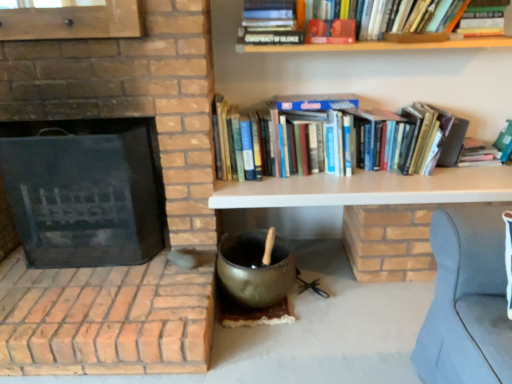
Question: Considering the relative sizes of hardcover books at upper right and white matte shelf at upper center in the image provided, is hardcover books at upper right bigger than white matte shelf at upper center?

Choices:
 (A) yes
 (B) no

Answer: (A)

Question: Is hardcover books at upper right not near white matte shelf at upper center?

Choices:
 (A) no
 (B) yes

Answer: (A)

Question: From the image's perspective, is hardcover books at upper right located above white matte shelf at upper center?

Choices:
 (A) yes
 (B) no

Answer: (A)

Question: Considering the relative positions of hardcover books at upper right and white matte shelf at upper center in the image provided, is hardcover books at upper right behind white matte shelf at upper center?

Choices:
 (A) yes
 (B) no

Answer: (A)

Question: Does hardcover books at upper right have a greater height compared to white matte shelf at upper center?

Choices:
 (A) yes
 (B) no

Answer: (A)

Question: From the image's perspective, is hardcover books at upper right located beneath white matte shelf at upper center?

Choices:
 (A) no
 (B) yes

Answer: (A)

Question: Can you see black matte fireplace at left touching hardcover books at upper right?

Choices:
 (A) yes
 (B) no

Answer: (B)

Question: From the image's perspective, is black matte fireplace at left on hardcover books at upper right?

Choices:
 (A) no
 (B) yes

Answer: (A)

Question: Considering the relative sizes of black matte fireplace at left and hardcover books at upper right in the image provided, is black matte fireplace at left taller than hardcover books at upper right?

Choices:
 (A) yes
 (B) no

Answer: (A)

Question: From a real-world perspective, does black matte fireplace at left sit lower than hardcover books at upper right?

Choices:
 (A) no
 (B) yes

Answer: (B)

Question: Does black matte fireplace at left have a lesser height compared to hardcover books at upper right?

Choices:
 (A) yes
 (B) no

Answer: (B)

Question: Considering the relative sizes of black matte fireplace at left and hardcover books at upper right in the image provided, is black matte fireplace at left thinner than hardcover books at upper right?

Choices:
 (A) no
 (B) yes

Answer: (A)

Question: Are white matte shelf at upper center and hardcover books at upper right far apart?

Choices:
 (A) no
 (B) yes

Answer: (A)